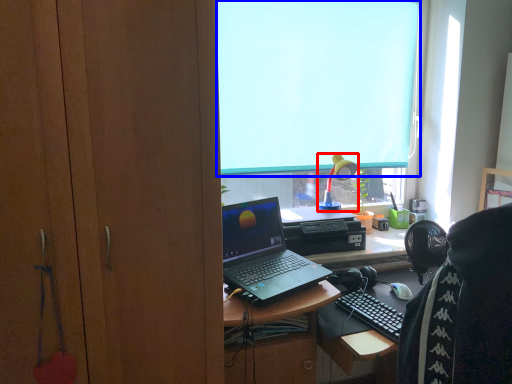
Question: Which object appears farthest to the camera in this image, lamp (highlighted by a red box) or window screen (highlighted by a blue box)?

Choices:
 (A) lamp
 (B) window screen

Answer: (A)